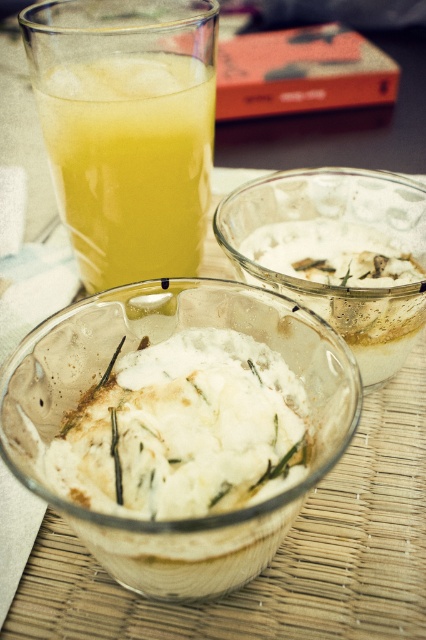
You are a food stylist arranging a dessert display. You have a translucent yellow liquid at upper left and a white frosted glass bowl at center. Which item should you move to the right side to balance the composition?

The translucent yellow liquid at upper left should be moved to the right side of the white frosted glass bowl at center to balance the composition since it is currently positioned on the left side.

You are holding a spoon and want to reach the translucent yellow liquid at upper left from where you are standing. Considering the distance, is it possible to do so without moving your position?

The translucent yellow liquid at upper left is 10.84 inches away from camera, so yes, it is possible to reach it with a spoon from your current position without moving.

You are a food stylist arranging two desserts on a table. You have a white frosted bowl at center and a white frosted glass bowl at center. Which bowl should you choose if you want to serve a larger portion of dessert?

The white frosted bowl at center has a larger width than the white frosted glass bowl at center, so it can hold a bigger portion of dessert.